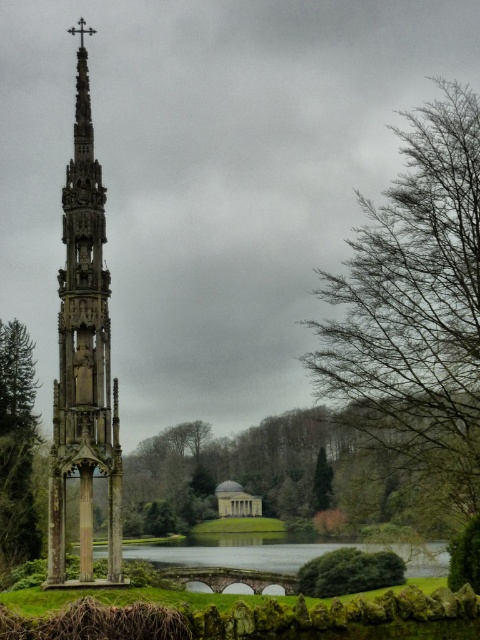
Question: Which object is positioned closest to the clear water at lower center?

Choices:
 (A) metallic cross at upper center
 (B) white stone church at center
 (C) bare branches at right
 (D) stone carved tower at left

Answer: (B)

Question: Does bare branches at right have a smaller size compared to metallic cross at upper center?

Choices:
 (A) no
 (B) yes

Answer: (A)

Question: Which point appears farthest from the camera in this image?

Choices:
 (A) (24, 448)
 (B) (216, 538)
 (C) (107, 472)
 (D) (332, 476)

Answer: (B)

Question: Observing the image, what is the correct spatial positioning of bare branches at right in reference to green textured tree at left?

Choices:
 (A) below
 (B) above

Answer: (B)

Question: Is the position of bare branches at right more distant than that of metallic cross at upper center?

Choices:
 (A) yes
 (B) no

Answer: (B)

Question: Estimate the real-world distances between objects in this image. Which object is farther from the white stone church at center?

Choices:
 (A) green textured tree at left
 (B) stone carved tower at left
 (C) bare branches at right
 (D) clear water at lower center

Answer: (B)